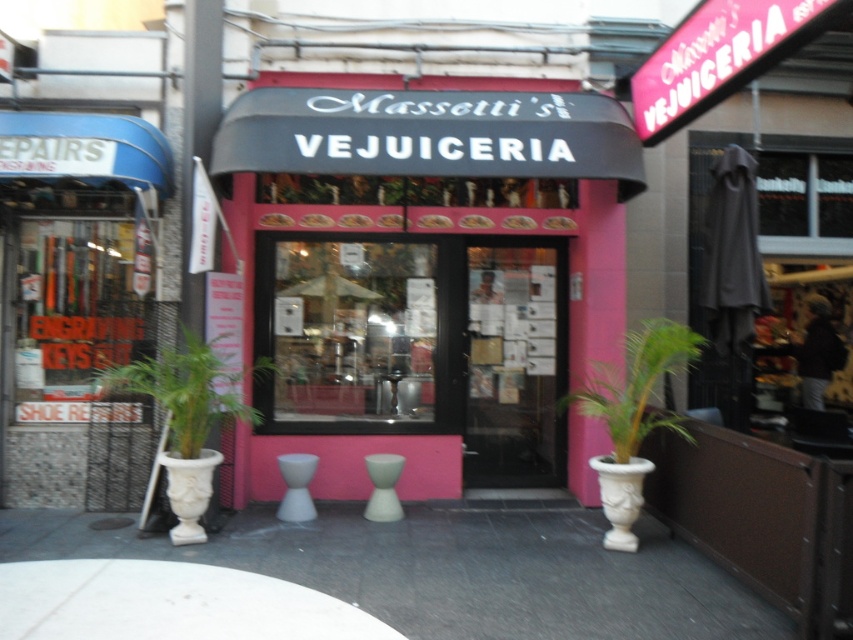
You are standing in front of Massetti Vejuiceria and want to place a small plant between the two points marked as point (490,353) and point (640,442). Which point should the plant be closer to in order to be closer to the entrance?

The plant should be closer to point (490,353) because it is closer to the entrance than point (640,442).

You are a delivery person standing outside Massetti Vejuiceria. You need to deliver a package to the store. The package is 1.5 meters wide. Can you walk through the transparent glass door at center to deliver the package?

The transparent glass door at center is 7.17 meters away from the viewer. Since the package is 1.5 meters wide, the distance is sufficient for the delivery person to approach and deliver the package through the transparent glass door at center.